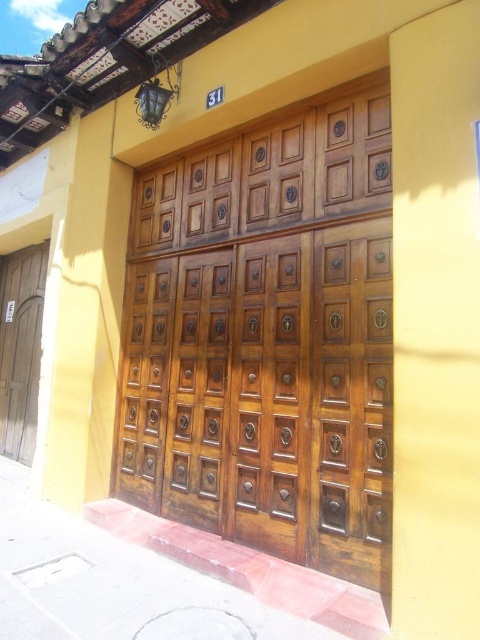
Is polished wood door at center further to camera compared to wooden door at left?

No.

Is point (332, 180) behind point (34, 362)?

No, it is in front of (34, 362).

Find the location of a particular element. This screenshot has height=640, width=480. polished wood door at center is located at coordinates (266, 337).